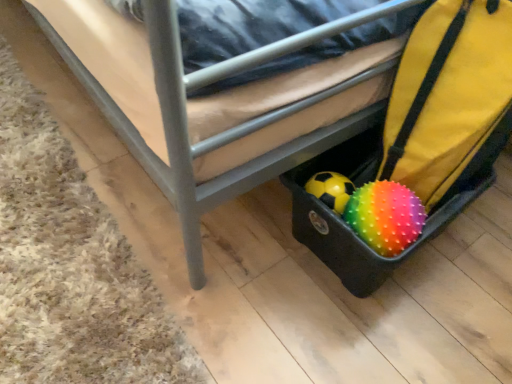
I want to click on vacant area that is situated to the right of rubberized black suitcase at lower right, so pyautogui.click(x=472, y=258).